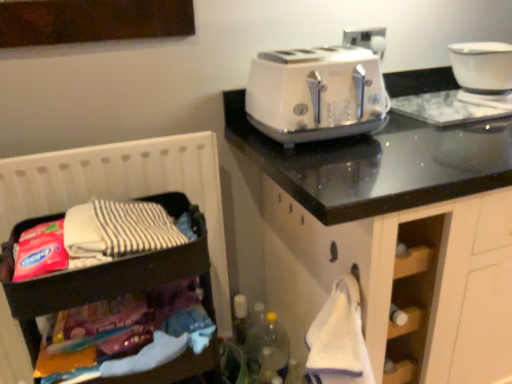
Question: Is white glossy toaster at upper right oriented towards wooden dark brown storage at left?

Choices:
 (A) yes
 (B) no

Answer: (B)

Question: Is white glossy toaster at upper right shorter than wooden dark brown storage at left?

Choices:
 (A) no
 (B) yes

Answer: (B)

Question: Considering the relative sizes of white glossy toaster at upper right and wooden dark brown storage at left in the image provided, is white glossy toaster at upper right taller than wooden dark brown storage at left?

Choices:
 (A) yes
 (B) no

Answer: (B)

Question: Is white glossy toaster at upper right in front of wooden dark brown storage at left?

Choices:
 (A) no
 (B) yes

Answer: (A)

Question: Is wooden dark brown storage at left inside white glossy toaster at upper right?

Choices:
 (A) no
 (B) yes

Answer: (A)

Question: Considering the positions of point (487, 66) and point (101, 168), is point (487, 66) closer or farther from the camera than point (101, 168)?

Choices:
 (A) closer
 (B) farther

Answer: (B)

Question: Is white glossy bowl at upper right in front of or behind wooden dark brown storage at left in the image?

Choices:
 (A) front
 (B) behind

Answer: (B)

Question: From the image's perspective, relative to wooden dark brown storage at left, is white glossy bowl at upper right above or below?

Choices:
 (A) above
 (B) below

Answer: (A)

Question: Is white glossy bowl at upper right inside the boundaries of wooden dark brown storage at left, or outside?

Choices:
 (A) inside
 (B) outside

Answer: (B)

Question: Is wooden dark brown storage at left taller or shorter than white glossy bowl at upper right?

Choices:
 (A) tall
 (B) short

Answer: (A)

Question: Would you say wooden dark brown storage at left is to the left or to the right of white glossy bowl at upper right in the picture?

Choices:
 (A) right
 (B) left

Answer: (B)

Question: From the image's perspective, relative to white glossy bowl at upper right, is wooden dark brown storage at left above or below?

Choices:
 (A) below
 (B) above

Answer: (A)

Question: Considering the positions of wooden dark brown storage at left and white glossy bowl at upper right in the image, is wooden dark brown storage at left wider or thinner than white glossy bowl at upper right?

Choices:
 (A) wide
 (B) thin

Answer: (B)

Question: From their relative heights in the image, would you say wooden dark brown storage at left is taller or shorter than white glossy toaster at upper right?

Choices:
 (A) tall
 (B) short

Answer: (A)

Question: From the image's perspective, is wooden dark brown storage at left above or below white glossy toaster at upper right?

Choices:
 (A) above
 (B) below

Answer: (B)